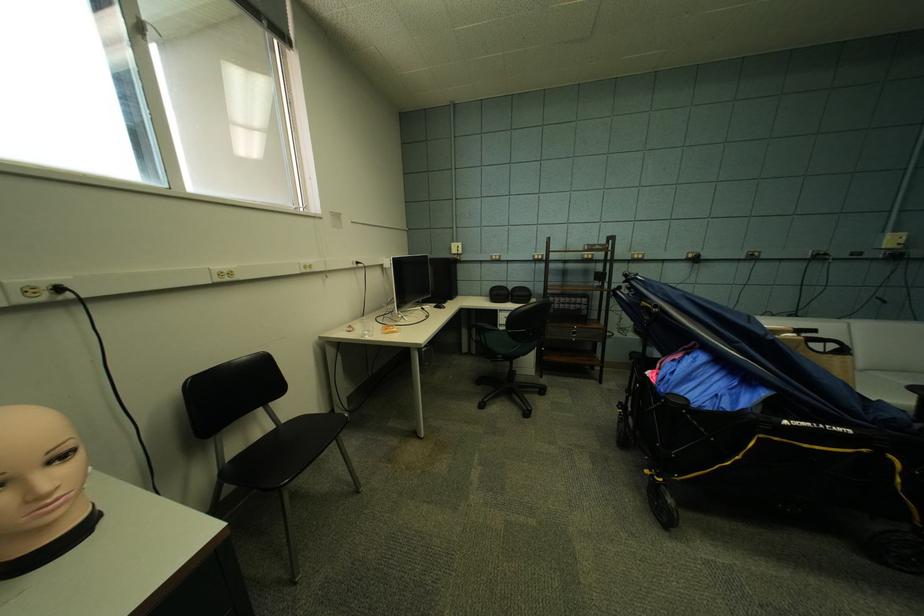
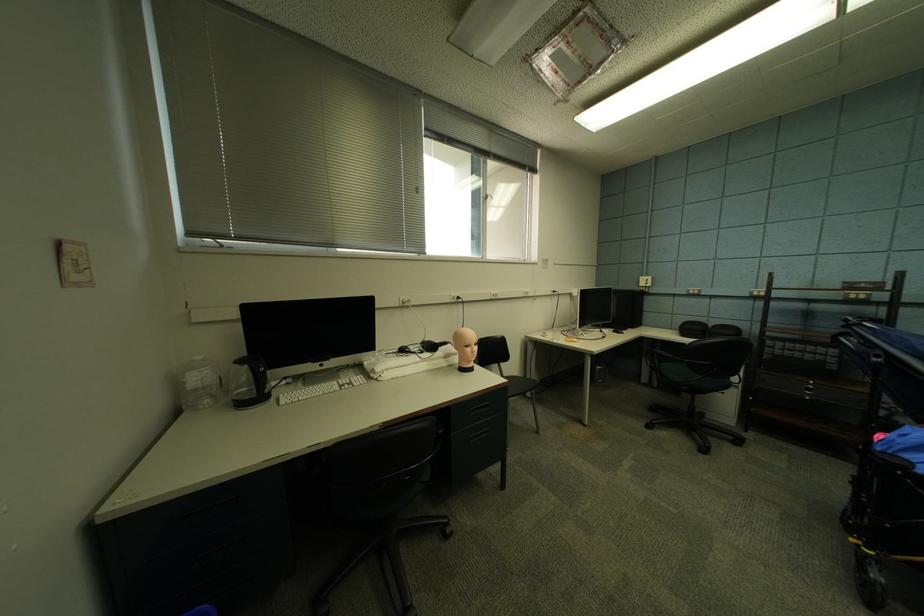
Find the pixel in the second image that matches point 462,248 in the first image.

(650, 282)